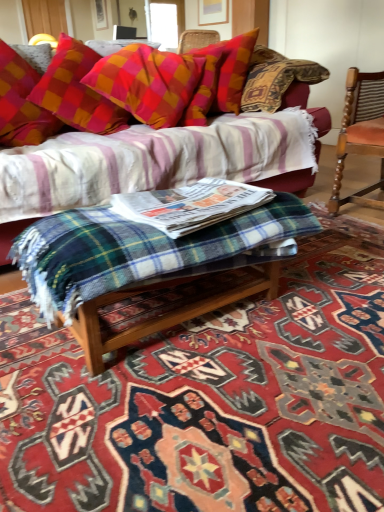
The image size is (384, 512). Describe the element at coordinates (210, 399) in the screenshot. I see `plaid woolen blanket at center` at that location.

The width and height of the screenshot is (384, 512). What do you see at coordinates (290, 182) in the screenshot?
I see `plaid fabric couch at upper center` at bounding box center [290, 182].

Measure the distance between point (8, 263) and camera.

The distance of point (8, 263) from camera is 1.63 meters.

In order to click on green plaid blanket at center in this screenshot , I will do `click(138, 250)`.

Does point (330, 121) lie in front of point (157, 344)?

No, (330, 121) is further to viewer.

Find the location of a particular element. Image resolution: width=384 pixels, height=512 pixels. mat that is in front of the plaid fabric couch at upper center is located at coordinates click(x=210, y=399).

From a real-world perspective, is plaid fabric couch at upper center under plaid woolen blanket at center?

No.

Is plaid fabric couch at upper center bigger than plaid woolen blanket at center?

Yes.

Is plaid fabric couch at upper center at the back of green plaid blanket at center?

Yes, plaid fabric couch at upper center is at the back of green plaid blanket at center.

From a real-world perspective, does green plaid blanket at center stand above plaid fabric couch at upper center?

Actually, green plaid blanket at center is physically below plaid fabric couch at upper center in the real world.

Which is closer, (x=39, y=243) or (x=291, y=104)?

Point (x=39, y=243) is closer to the camera than point (x=291, y=104).

From the image's perspective, which is below, green plaid blanket at center or plaid fabric couch at upper center?

green plaid blanket at center is shown below in the image.

Which of these two, green plaid blanket at center or wooden chair with striped upholstery at right, is wider?

With larger width is wooden chair with striped upholstery at right.

From the picture: Does green plaid blanket at center appear on the left side of wooden chair with striped upholstery at right?

Correct, you'll find green plaid blanket at center to the left of wooden chair with striped upholstery at right.

Is green plaid blanket at center turned away from wooden chair with striped upholstery at right?

green plaid blanket at center does not have its back to wooden chair with striped upholstery at right.

Image resolution: width=384 pixels, height=512 pixels. In order to click on bedding on the left of wooden chair with striped upholstery at right in this screenshot , I will do `click(138, 250)`.

From the image's perspective, is plaid fabric couch at upper center above or below green plaid blanket at center?

From the image's perspective, plaid fabric couch at upper center appears above green plaid blanket at center.

Does plaid fabric couch at upper center have a smaller size compared to green plaid blanket at center?

No.

Between plaid fabric couch at upper center and green plaid blanket at center, which one has less height?

With less height is green plaid blanket at center.

Based on the photo, which object is thinner, plaid fabric couch at upper center or green plaid blanket at center?

green plaid blanket at center is thinner.

In terms of size, does wooden chair with striped upholstery at right appear bigger or smaller than plaid fabric pillow at upper center?

Clearly, wooden chair with striped upholstery at right is smaller in size than plaid fabric pillow at upper center.

Based on the photo, is wooden chair with striped upholstery at right positioned beyond the bounds of plaid fabric pillow at upper center?

That's correct, wooden chair with striped upholstery at right is outside of plaid fabric pillow at upper center.

Is wooden chair with striped upholstery at right positioned with its back to plaid fabric pillow at upper center?

No.

Which object is wider, wooden chair with striped upholstery at right or plaid fabric pillow at upper center?

wooden chair with striped upholstery at right.

From a real-world perspective, is plaid fabric couch at upper center above or below plaid fabric pillow at upper center?

In terms of real-world spatial position, plaid fabric couch at upper center is below plaid fabric pillow at upper center.

Which of these two, plaid fabric couch at upper center or plaid fabric pillow at upper center, stands shorter?

plaid fabric pillow at upper center.

The height and width of the screenshot is (512, 384). In order to click on pillow located on the left of plaid fabric couch at upper center in this screenshot , I will do `click(147, 83)`.

Can you confirm if plaid fabric couch at upper center is bigger than plaid fabric pillow at upper center?

Correct, plaid fabric couch at upper center is larger in size than plaid fabric pillow at upper center.

Considering the sizes of objects plaid fabric pillow at upper center and wooden chair with striped upholstery at right in the image provided, who is shorter, plaid fabric pillow at upper center or wooden chair with striped upholstery at right?

plaid fabric pillow at upper center is shorter.

Considering the points (163, 106) and (382, 134), which point is in front, point (163, 106) or point (382, 134)?

Point (382, 134)

Considering the relative positions of plaid fabric pillow at upper center and wooden chair with striped upholstery at right in the image provided, is plaid fabric pillow at upper center to the left or to the right of wooden chair with striped upholstery at right?

plaid fabric pillow at upper center is to the left of wooden chair with striped upholstery at right.

Which object is thinner, plaid fabric pillow at upper center or wooden chair with striped upholstery at right?

plaid fabric pillow at upper center.

You are a GUI agent. You are given a task and a screenshot of the screen. Output one action in this format:
    pyautogui.click(x=<x>, y=<y>)
    Task: Click on the studio couch on the left of plaid woolen blanket at center
    
    Given the screenshot: What is the action you would take?
    click(290, 182)

Where is `studio couch behind the green plaid blanket at center`? This screenshot has height=512, width=384. studio couch behind the green plaid blanket at center is located at coordinates [290, 182].

When comparing their distances from plaid woolen blanket at center, does plaid fabric pillow at upper center or plaid fabric couch at upper center seem closer?

plaid fabric pillow at upper center is closer to plaid woolen blanket at center.

In the scene shown: When comparing their distances from plaid woolen blanket at center, does green plaid blanket at center or plaid fabric couch at upper center seem closer?

green plaid blanket at center is positioned closer to the anchor plaid woolen blanket at center.

Looking at the image, which one is located further to plaid woolen blanket at center, plaid fabric pillow at upper center or wooden chair with striped upholstery at right?

The object further to plaid woolen blanket at center is plaid fabric pillow at upper center.

Considering their positions, is plaid fabric couch at upper center positioned closer to plaid fabric pillow at upper center than plaid woolen blanket at center?

Based on the image, plaid fabric couch at upper center appears to be nearer to plaid fabric pillow at upper center.

From the image, which object appears to be nearer to wooden chair with striped upholstery at right, plaid woolen blanket at center or plaid fabric couch at upper center?

The object closer to wooden chair with striped upholstery at right is plaid fabric couch at upper center.

Considering their positions, is plaid woolen blanket at center positioned closer to wooden chair with striped upholstery at right than plaid fabric pillow at upper center?

plaid fabric pillow at upper center is positioned closer to the anchor wooden chair with striped upholstery at right.

Estimate the real-world distances between objects in this image. Which object is closer to plaid woolen blanket at center, plaid fabric pillow at upper center or green plaid blanket at center?

The object closer to plaid woolen blanket at center is green plaid blanket at center.

When comparing their distances from green plaid blanket at center, does plaid fabric couch at upper center or plaid fabric pillow at upper center seem closer?

Among the two, plaid fabric pillow at upper center is located nearer to green plaid blanket at center.

Identify the location of studio couch between plaid woolen blanket at center and plaid fabric pillow at upper center along the z-axis. Image resolution: width=384 pixels, height=512 pixels. point(290,182).

Locate an element on the screen. The width and height of the screenshot is (384, 512). studio couch positioned between green plaid blanket at center and plaid fabric pillow at upper center from near to far is located at coordinates (290, 182).

Where is `bedding positioned between plaid woolen blanket at center and wooden chair with striped upholstery at right from near to far`? bedding positioned between plaid woolen blanket at center and wooden chair with striped upholstery at right from near to far is located at coordinates [x=138, y=250].

Where is `bedding between plaid fabric couch at upper center and wooden chair with striped upholstery at right in the horizontal direction`? Image resolution: width=384 pixels, height=512 pixels. bedding between plaid fabric couch at upper center and wooden chair with striped upholstery at right in the horizontal direction is located at coordinates pos(138,250).